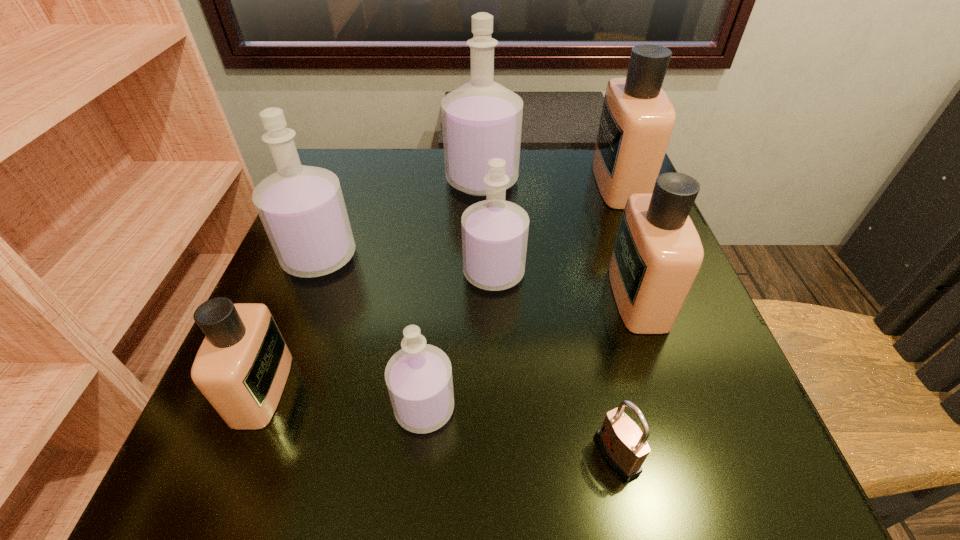
Where is `vacant region located 0.200m on the back of the nearest purple perfume`? The image size is (960, 540). vacant region located 0.200m on the back of the nearest purple perfume is located at coordinates (436, 287).

You are a GUI agent. You are given a task and a screenshot of the screen. Output one action in this format:
    pyautogui.click(x=<x>, y=<y>)
    Task: Click on the vacant area situated on the front label of the nearest beige perfume
    This screenshot has width=960, height=540.
    Given the screenshot: What is the action you would take?
    pyautogui.click(x=477, y=389)

Where is `vacant space located 0.350m on the back of the sixth object from left to right`? The width and height of the screenshot is (960, 540). vacant space located 0.350m on the back of the sixth object from left to right is located at coordinates (574, 260).

At what (x,y) coordinates should I click in order to perform the action: click on object positioned at the near edge. Please return your answer as a coordinate pair (x, y). Image resolution: width=960 pixels, height=540 pixels. Looking at the image, I should click on (624, 446).

Identify the location of object that is at the far right corner. This screenshot has height=540, width=960. (637, 119).

I want to click on vacant space at the far edge of the desktop, so click(543, 152).

Locate an element on the screen. vacant space at the near edge is located at coordinates (511, 460).

The image size is (960, 540). I want to click on free space at the left edge of the desktop, so click(x=371, y=227).

You are a GUI agent. You are given a task and a screenshot of the screen. Output one action in this format:
    pyautogui.click(x=<x>, y=<y>)
    Task: Click on the vacant space at the right edge of the desktop
    Image resolution: width=960 pixels, height=540 pixels.
    Given the screenshot: What is the action you would take?
    pyautogui.click(x=622, y=354)

You are a GUI agent. You are given a task and a screenshot of the screen. Output one action in this format:
    pyautogui.click(x=<x>, y=<y>)
    Task: Click on the blank area at the far left corner
    This screenshot has width=960, height=540.
    Given the screenshot: What is the action you would take?
    pyautogui.click(x=368, y=164)